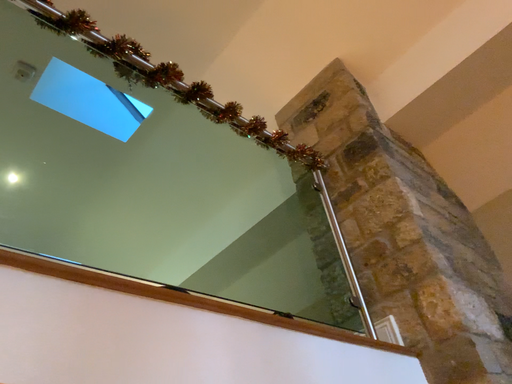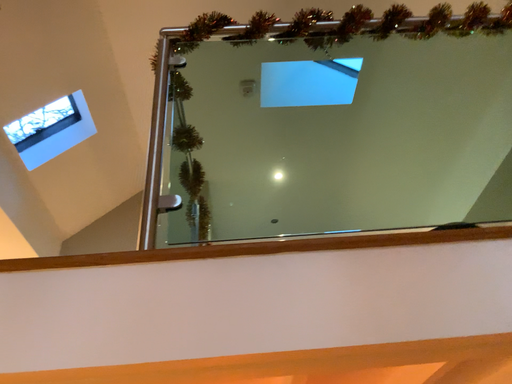
Question: How did the camera likely rotate when shooting the video?

Choices:
 (A) rotated right
 (B) rotated left

Answer: (B)